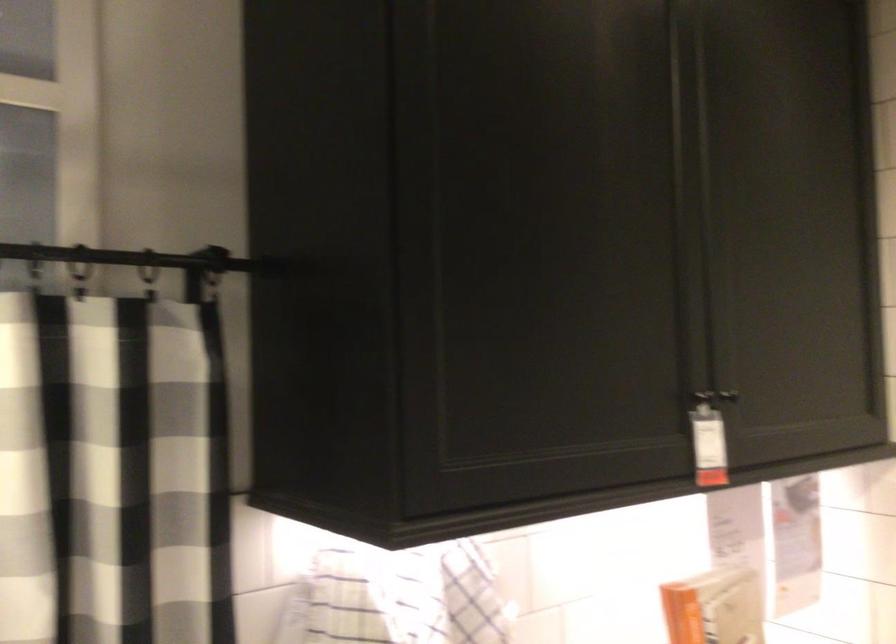
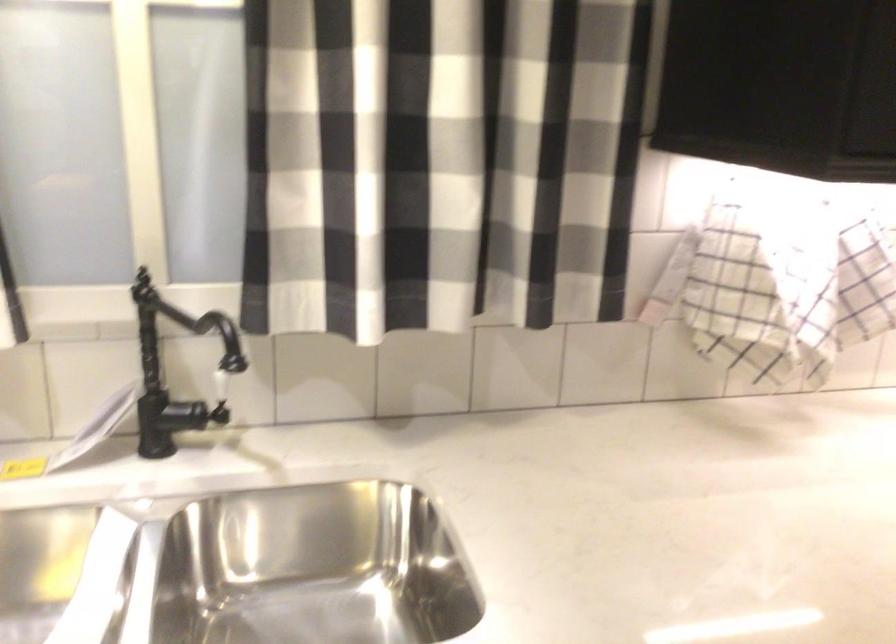
Question: In a continuous first-person perspective shot, in which direction is the camera moving?

Choices:
 (A) Left
 (B) Right
 (C) Forward
 (D) Backward

Answer: (A)